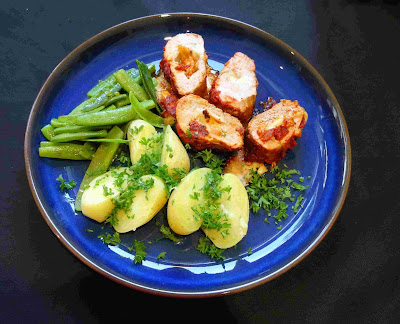
Locate an element on the screen. Image resolution: width=400 pixels, height=324 pixels. top of plate is located at coordinates (193, 6).